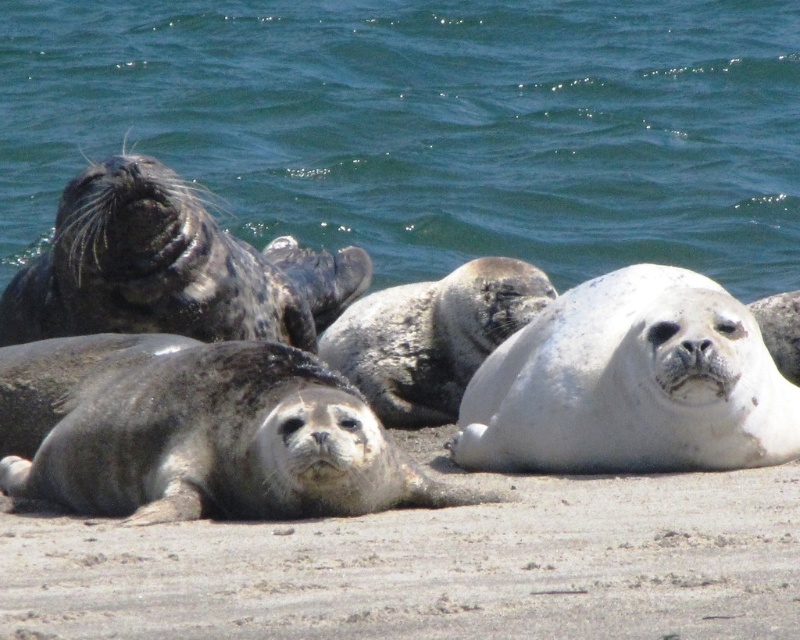
Which is more to the right, green water at upper left or sandy brown at lower center?

sandy brown at lower center is more to the right.

This screenshot has width=800, height=640. Find the location of `green water at upper left`. green water at upper left is located at coordinates (428, 125).

Find the location of a particular element. The height and width of the screenshot is (640, 800). green water at upper left is located at coordinates (428, 125).